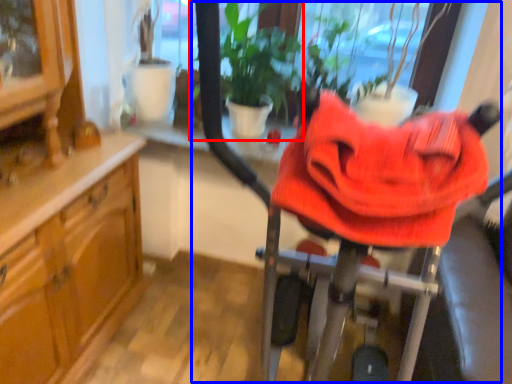
Question: Among these objects, which one is farthest to the camera, houseplant (highlighted by a red box) or baby carriage (highlighted by a blue box)?

Choices:
 (A) houseplant
 (B) baby carriage

Answer: (A)